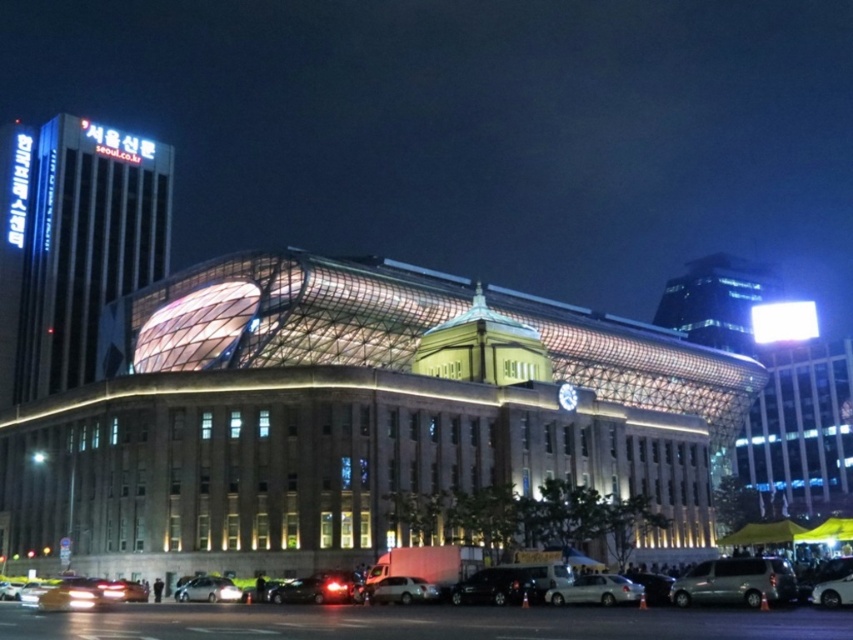
Question: Is silver metallic car at lower center positioned before shiny silver van at center?

Choices:
 (A) yes
 (B) no

Answer: (A)

Question: Is silver metallic car at lower center below shiny silver van at center?

Choices:
 (A) yes
 (B) no

Answer: (B)

Question: Does silver metallic car at lower center appear on the left side of shiny silver van at center?

Choices:
 (A) no
 (B) yes

Answer: (A)

Question: Based on their relative distances, which object is nearer to the silver metallic car at lower center?

Choices:
 (A) white matte car at lower center
 (B) silver metallic van at lower right
 (C) shiny silver van at center

Answer: (B)

Question: Which object is the closest to the silver metallic car at lower center?

Choices:
 (A) shiny black car at lower center
 (B) metallic glass building at upper left

Answer: (A)

Question: Which of the following is the closest to the observer?

Choices:
 (A) click(76, 186)
 (B) click(664, 492)

Answer: (B)